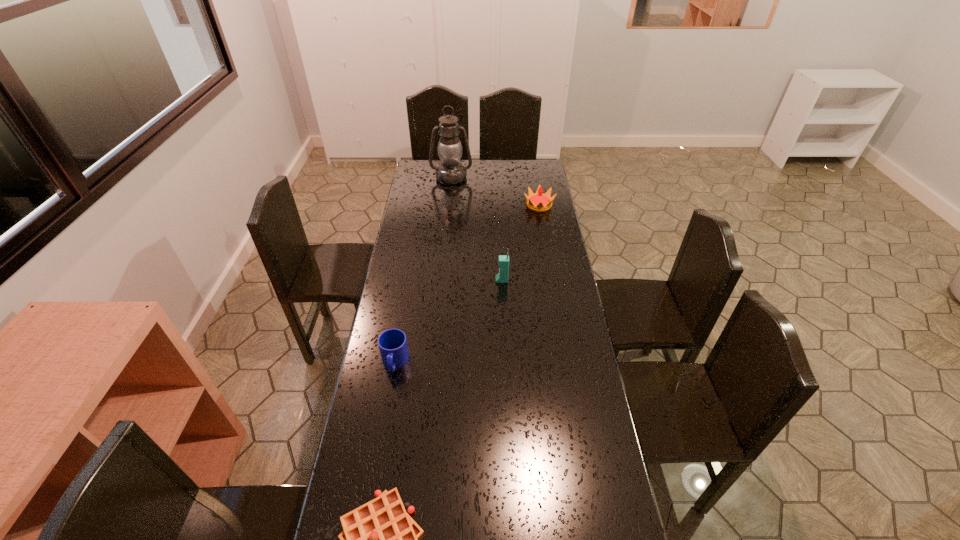
Where is `vacant region at the left edge of the desktop`? vacant region at the left edge of the desktop is located at coordinates (419, 261).

Find the location of a particular element. The image size is (960, 540). vacant region at the right edge of the desktop is located at coordinates (559, 321).

The image size is (960, 540). Identify the location of vacant space at the far right corner. (517, 164).

You are a GUI agent. You are given a task and a screenshot of the screen. Output one action in this format:
    pyautogui.click(x=<x>, y=<y>)
    Task: Click on the vacant area that lies between the oil lamp and the crown
    The width and height of the screenshot is (960, 540).
    Given the screenshot: What is the action you would take?
    (495, 192)

Identify the location of free space between the second farthest object and the second tallest object. The image size is (960, 540). (520, 243).

At what (x,y) coordinates should I click in order to perform the action: click on free space between the cellular telephone and the mug. Please return your answer as a coordinate pair (x, y). The image size is (960, 540). Looking at the image, I should click on (448, 321).

Locate an element on the screen. This screenshot has width=960, height=540. vacant area that lies between the fourth farthest object and the second tallest object is located at coordinates pyautogui.click(x=448, y=321).

Image resolution: width=960 pixels, height=540 pixels. I want to click on vacant point located between the fourth farthest object and the cellular telephone, so click(x=448, y=321).

The width and height of the screenshot is (960, 540). Find the location of `free space that is in between the third farthest object and the second shortest object`. free space that is in between the third farthest object and the second shortest object is located at coordinates (448, 321).

The image size is (960, 540). I want to click on empty location between the fourth farthest object and the cellular telephone, so click(x=448, y=321).